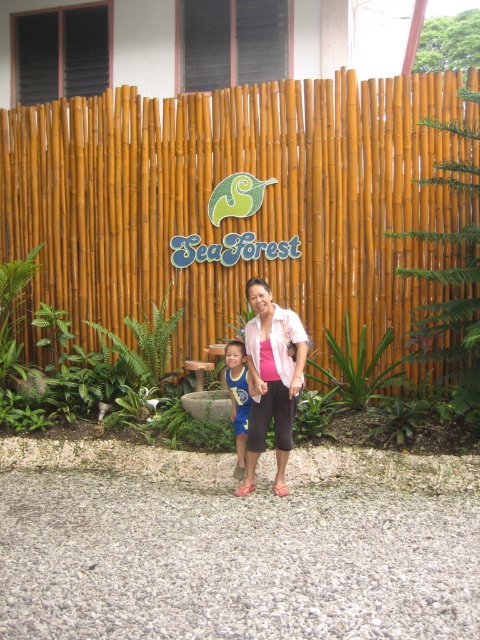
Question: Which of the following is the closest to the observer?

Choices:
 (A) (228, 364)
 (B) (418, 264)
 (C) (260, 376)

Answer: (C)

Question: Which object is the closest to the pink matte shirt at center?

Choices:
 (A) blue jersey at center
 (B) bamboo fence at center

Answer: (A)

Question: From the image, what is the correct spatial relationship of pink matte shirt at center in relation to blue jersey at center?

Choices:
 (A) right
 (B) left

Answer: (A)

Question: Among these points, which one is farthest from the camera?

Choices:
 (A) (243, 376)
 (B) (132, 225)
 (C) (252, 403)

Answer: (B)

Question: Does bamboo fence at center appear over blue jersey at center?

Choices:
 (A) yes
 (B) no

Answer: (A)

Question: Can you confirm if bamboo fence at center is positioned to the left of blue jersey at center?

Choices:
 (A) no
 (B) yes

Answer: (B)